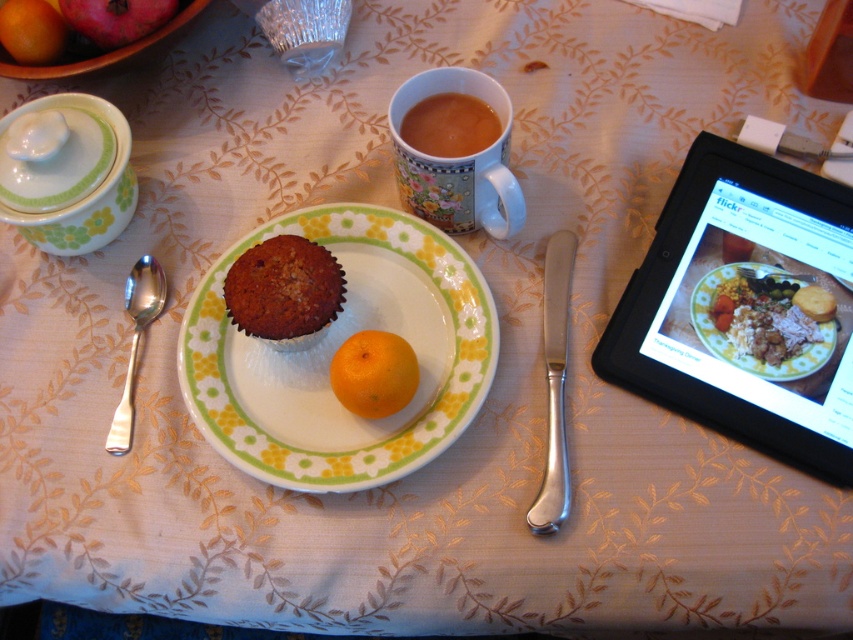
Does matte ceramic mug at upper center have a lesser height compared to orange matte at upper left?

No, matte ceramic mug at upper center is not shorter than orange matte at upper left.

Does point (424, 93) come in front of point (57, 20)?

Yes, point (424, 93) is closer to viewer.

This screenshot has height=640, width=853. What are the coordinates of `matte ceramic mug at upper center` in the screenshot? It's located at (457, 161).

Can you confirm if black plastic tablet at upper right is bigger than silver polished spoon at left?

Yes, black plastic tablet at upper right is bigger than silver polished spoon at left.

Who is shorter, black plastic tablet at upper right or silver polished spoon at left?

silver polished spoon at left

Does point (706, 147) come behind point (151, 285)?

No.

Where is `black plastic tablet at upper right`? This screenshot has width=853, height=640. black plastic tablet at upper right is located at coordinates (746, 307).

Is point (796, 224) farther from camera compared to point (792, 378)?

Yes, point (796, 224) is behind point (792, 378).

Between point (849, 253) and point (822, 339), which one is positioned behind?

The point (849, 253) is behind.

Which is in front, point (709, 218) or point (790, 314)?

Point (790, 314)

Where is `black plastic tablet at upper right`? black plastic tablet at upper right is located at coordinates (746, 307).